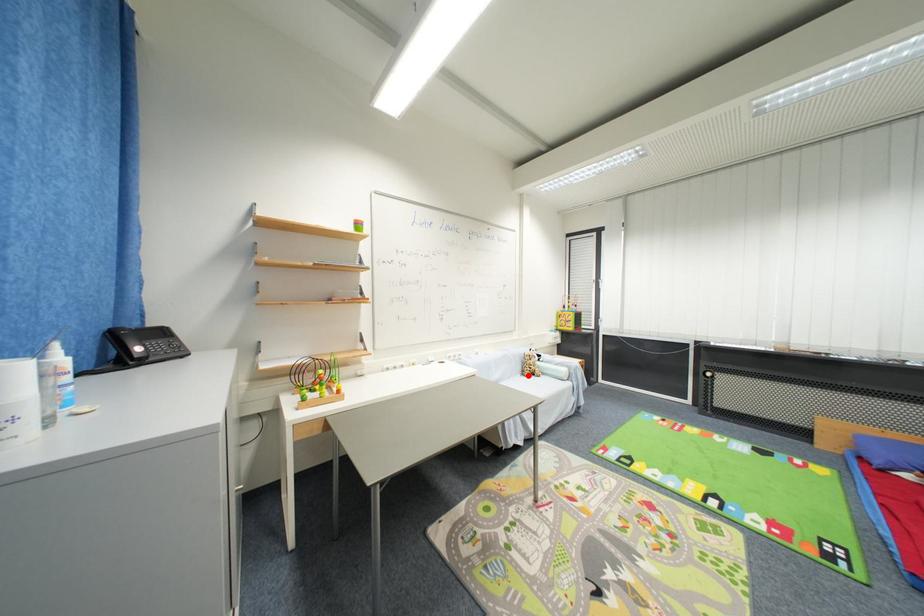
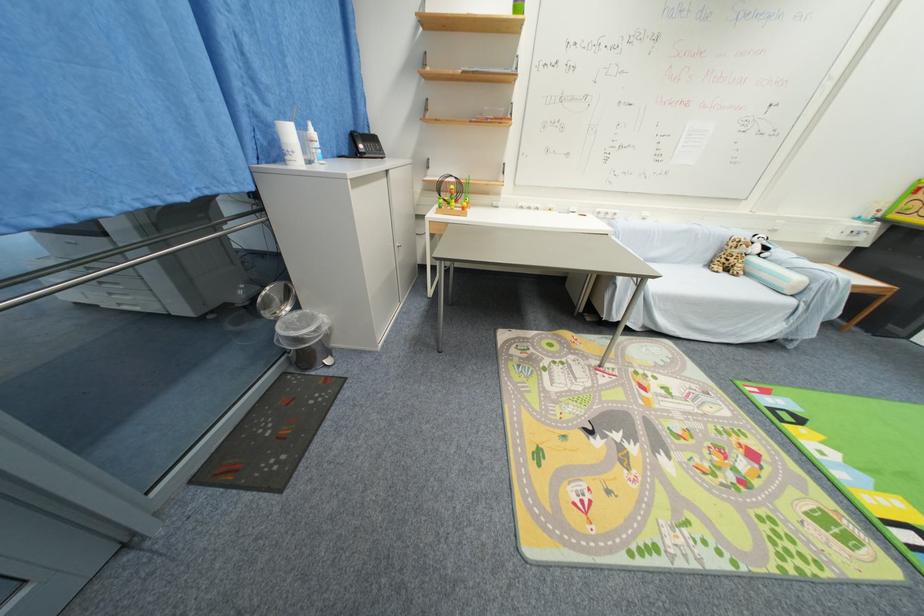
In the second image, find the point that corresponds to the highlighted location in the first image.

(714, 265)